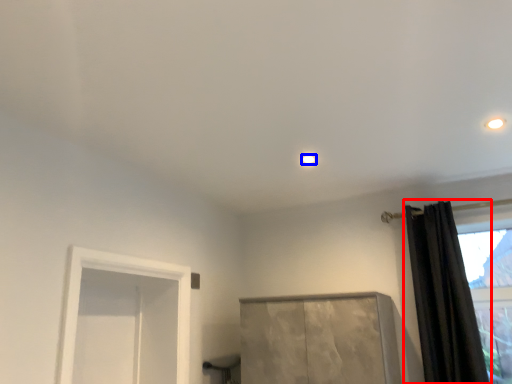
Question: Which point is closer to the camera, curtain (highlighted by a red box) or lighting (highlighted by a blue box)?

Choices:
 (A) curtain
 (B) lighting

Answer: (A)